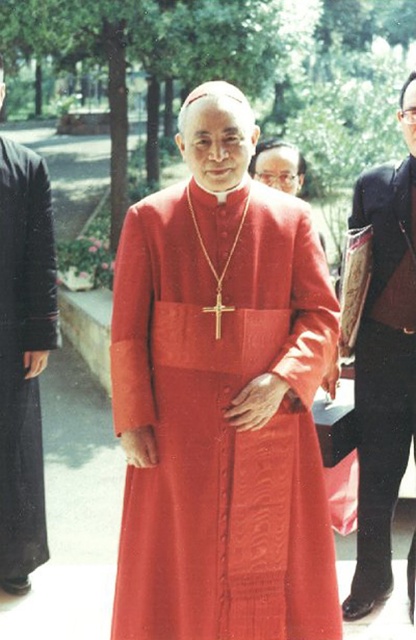
Question: Which object is the farthest from the black woolen robe at left?

Choices:
 (A) matte red robe at center
 (B) matte red robe at right

Answer: (B)

Question: Can you confirm if matte red robe at center is positioned below black woolen robe at left?

Choices:
 (A) yes
 (B) no

Answer: (A)

Question: Estimate the real-world distances between objects in this image. Which object is closer to the black woolen robe at left?

Choices:
 (A) matte red robe at center
 (B) matte red robe at right

Answer: (A)

Question: Can you confirm if matte red robe at center is thinner than matte red robe at right?

Choices:
 (A) yes
 (B) no

Answer: (B)

Question: Which point is farther to the camera?

Choices:
 (A) (178, 380)
 (B) (408, 384)

Answer: (B)

Question: Is matte red robe at right below black woolen robe at left?

Choices:
 (A) yes
 (B) no

Answer: (A)